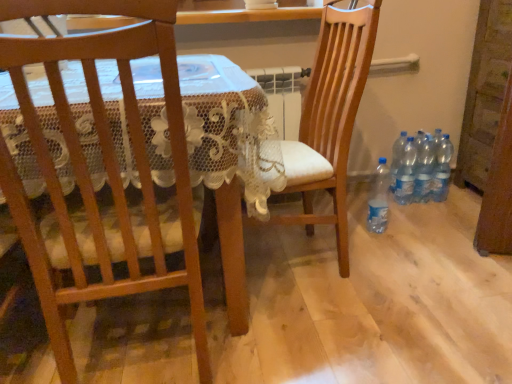
Identify the location of vacant area that lies in front of clear plastic bottles at lower right, the third bottle from the left. (413, 217).